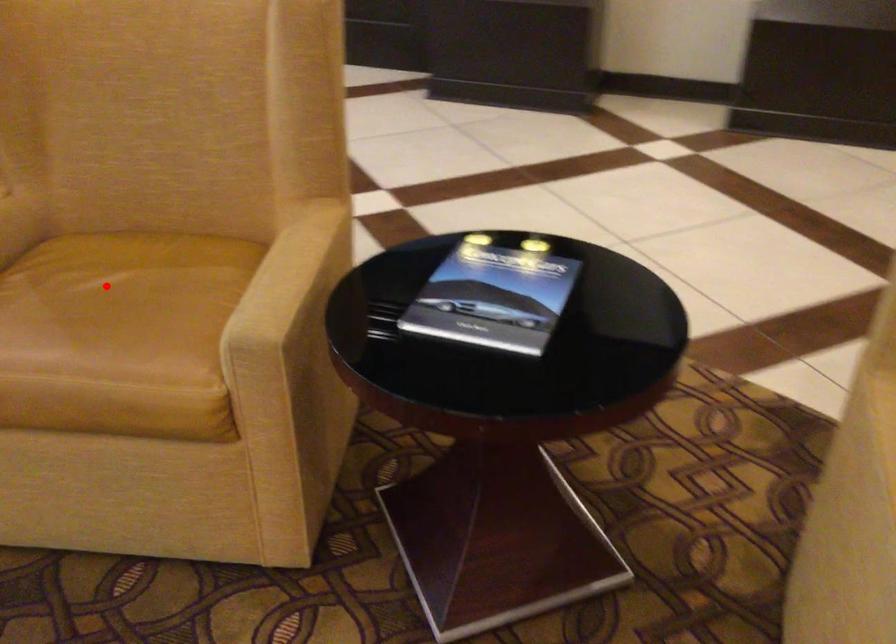
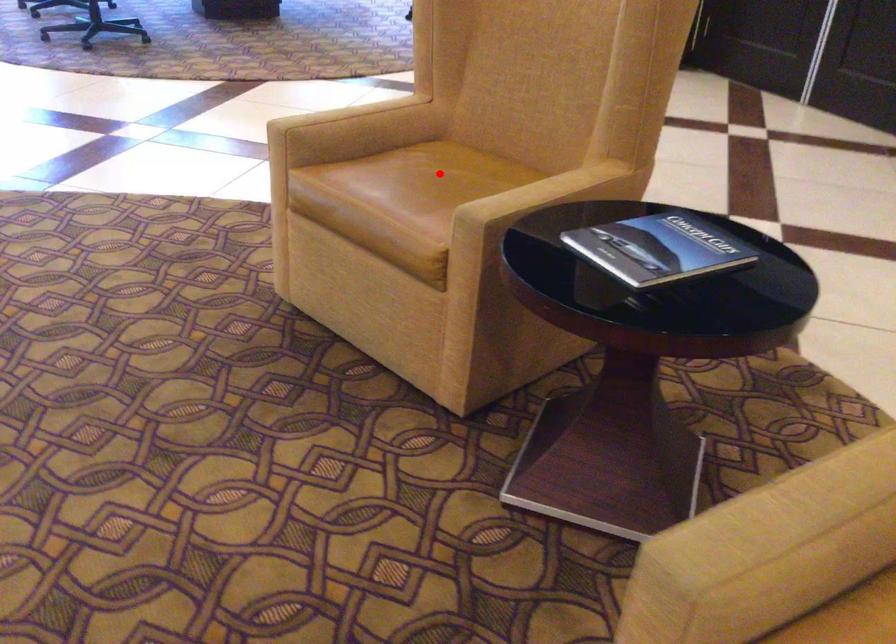
I am providing you with two images of the same scene from different viewpoints. A red point is marked on the first image and another point is marked on the second image. Does the point marked in image1 correspond to the same location as the one in image2?

Yes